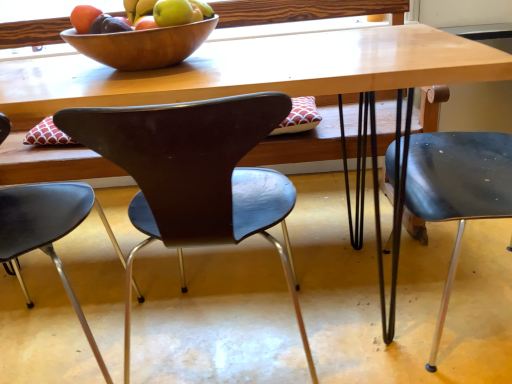
The width and height of the screenshot is (512, 384). In order to click on empty space that is ontop of matte brown chair at center, the 2th chair in the right-to-left sequence in this screenshot , I will do `click(166, 85)`.